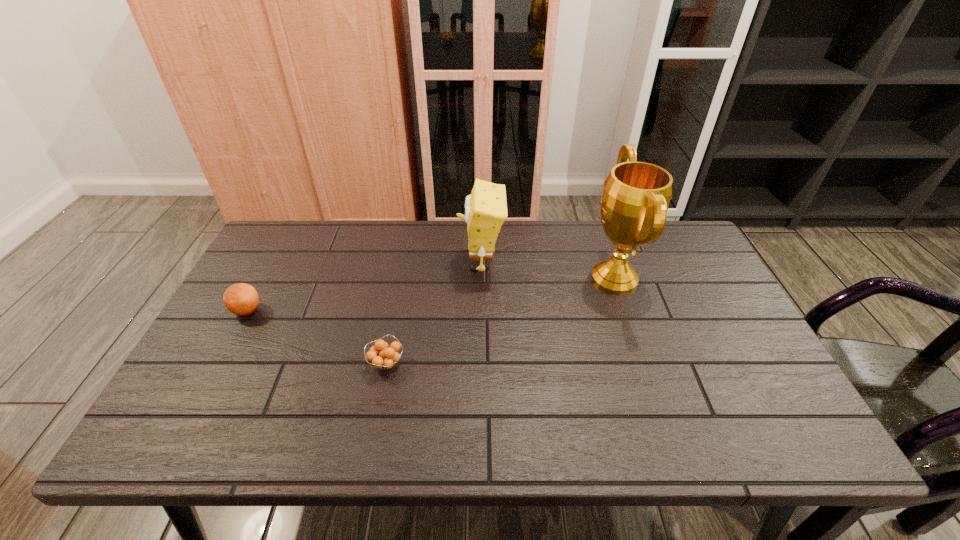
Locate an element on the screen. award is located at coordinates (636, 197).

In order to click on the rightmost object in this screenshot , I will do `click(636, 197)`.

Locate an element on the screen. the third shortest object is located at coordinates (486, 208).

Where is `the second object from right to left`? This screenshot has width=960, height=540. the second object from right to left is located at coordinates (486, 208).

Where is `the taller orange fruit`? The height and width of the screenshot is (540, 960). the taller orange fruit is located at coordinates (241, 299).

Locate an element on the screen. The width and height of the screenshot is (960, 540). the left orange fruit is located at coordinates (241, 299).

Where is `the shorter orange fruit`? the shorter orange fruit is located at coordinates 382,356.

Where is `the shortest object`? This screenshot has width=960, height=540. the shortest object is located at coordinates (382, 356).

The width and height of the screenshot is (960, 540). Identify the location of vacant space located 0.230m on the front-facing side of the tallest object. (509, 278).

Find the location of a particular element. vacant space situated on the front-facing side of the tallest object is located at coordinates click(559, 278).